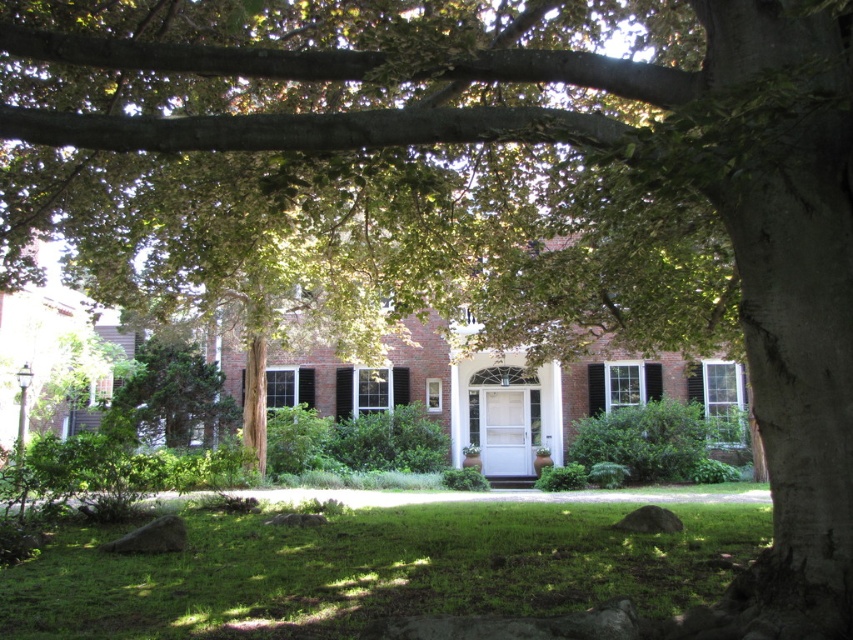
In the scene shown: Who is taller, white painted wood shutter at center or black wood shutter at center?

white painted wood shutter at center

Can you confirm if white painted wood shutter at center is shorter than black wood shutter at center?

No, white painted wood shutter at center is not shorter than black wood shutter at center.

The image size is (853, 640). I want to click on white painted wood shutter at center, so click(x=724, y=403).

Can you confirm if white painted wood shutter at center right is taller than white painted wood shutter at center left?

Yes, white painted wood shutter at center right is taller than white painted wood shutter at center left.

Between white painted wood shutter at center right and white painted wood shutter at center left, which one is positioned lower?

white painted wood shutter at center left is lower down.

Who is more forward, (592, 371) or (241, 396)?

Point (592, 371) is more forward.

This screenshot has height=640, width=853. Identify the location of white painted wood shutter at center right. (621, 385).

Is white painted wood shutter at center to the right of white painted wood shutter at center right from the viewer's perspective?

Correct, you'll find white painted wood shutter at center to the right of white painted wood shutter at center right.

Is white painted wood shutter at center behind white painted wood shutter at center right?

No, white painted wood shutter at center is closer to the viewer.

Between point (733, 413) and point (602, 392), which one is positioned behind?

Positioned behind is point (602, 392).

Find the location of `white painted wood shutter at center`. white painted wood shutter at center is located at coordinates (724, 403).